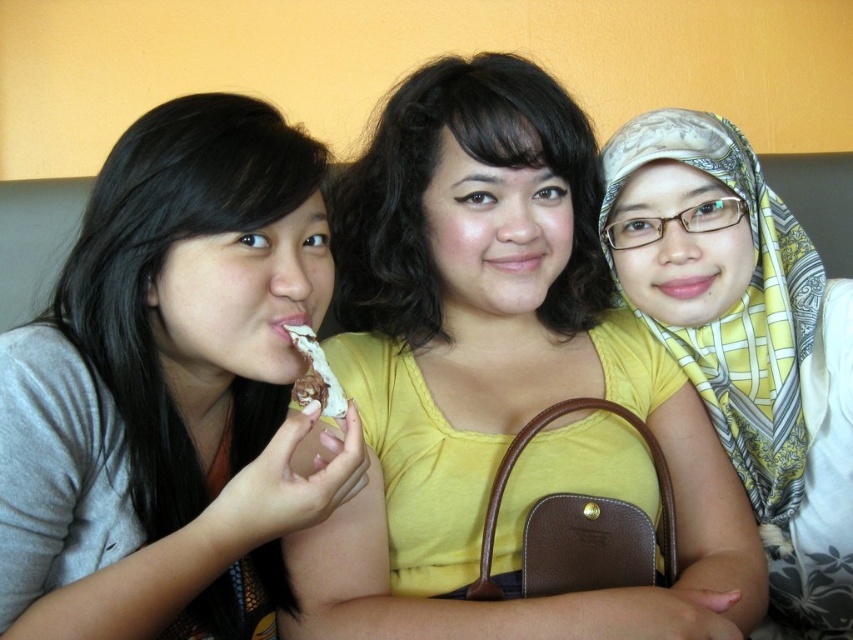
Is yellow matte shirt at center below chocolate frosted cake at center?

No, yellow matte shirt at center is not below chocolate frosted cake at center.

Consider the image. Can you confirm if yellow matte shirt at center is thinner than chocolate frosted cake at center?

No, yellow matte shirt at center is not thinner than chocolate frosted cake at center.

Does point (526, 189) come farther from viewer compared to point (312, 397)?

Yes, point (526, 189) is farther from viewer.

The width and height of the screenshot is (853, 640). Identify the location of yellow matte shirt at center. tap(495, 371).

Which is more to the left, yellow matte shirt at center or matte yellow shirt at center?

Positioned to the left is matte yellow shirt at center.

Does yellow matte shirt at center appear over matte yellow shirt at center?

Incorrect, yellow matte shirt at center is not positioned above matte yellow shirt at center.

What do you see at coordinates (495, 371) in the screenshot? The width and height of the screenshot is (853, 640). I see `yellow matte shirt at center` at bounding box center [495, 371].

Find the location of `yellow matte shirt at center`. yellow matte shirt at center is located at coordinates (495, 371).

Who is lower down, matte yellow shirt at center or chocolate frosted cake at center?

chocolate frosted cake at center is lower down.

From the picture: Is matte yellow shirt at center bigger than chocolate frosted cake at center?

Indeed, matte yellow shirt at center has a larger size compared to chocolate frosted cake at center.

This screenshot has height=640, width=853. I want to click on matte yellow shirt at center, so click(x=428, y=180).

Find the location of a particular element. The height and width of the screenshot is (640, 853). matte yellow shirt at center is located at coordinates (428, 180).